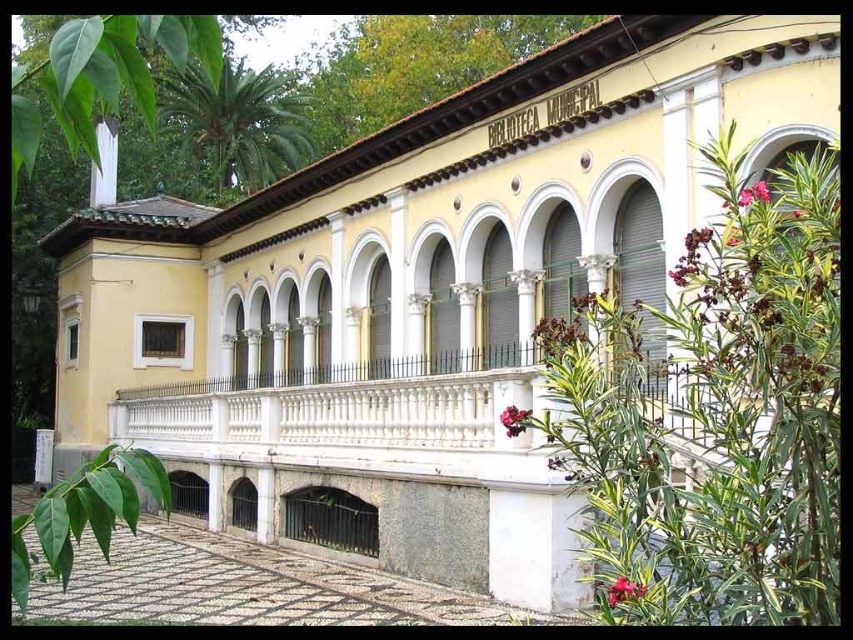
Does pink matte flower at lower right appear on the right side of pink matte flower at center?

Correct, you'll find pink matte flower at lower right to the right of pink matte flower at center.

Who is positioned more to the left, pink matte flower at lower right or pink matte flower at center?

pink matte flower at center is more to the left.

Identify the location of pink matte flower at lower right. The width and height of the screenshot is (853, 640). [x=624, y=589].

The image size is (853, 640). I want to click on pink matte flower at lower right, so click(624, 589).

Is gray concrete courtyard at lower center above pink matte flower at lower right?

No.

Is gray concrete courtyard at lower center wider than pink matte flower at lower right?

Yes, gray concrete courtyard at lower center is wider than pink matte flower at lower right.

Between point (146, 593) and point (630, 593), which one is positioned in front?

Positioned in front is point (630, 593).

Where is `gray concrete courtyard at lower center`? gray concrete courtyard at lower center is located at coordinates (248, 586).

Who is more forward, (254, 600) or (514, 432)?

Point (514, 432) is in front.

In order to click on gray concrete courtyard at lower center in this screenshot , I will do `click(248, 586)`.